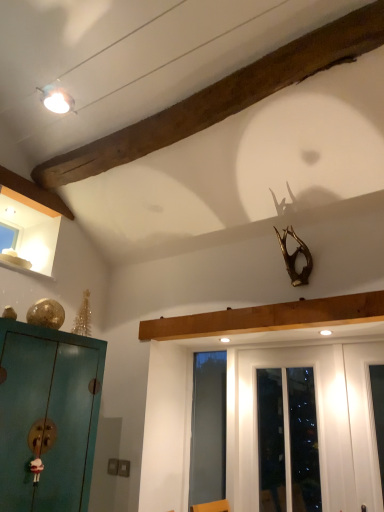
What do you see at coordinates (48, 416) in the screenshot? This screenshot has height=512, width=384. I see `teal matte cabinet at left` at bounding box center [48, 416].

Where is `white glossy door at center`? Image resolution: width=384 pixels, height=512 pixels. white glossy door at center is located at coordinates (317, 421).

You are a GUI agent. You are given a task and a screenshot of the screen. Output one action in this format:
    pyautogui.click(x=<x>, y=<y>)
    Task: Click on the light fixture above the teal matte cabinet at left (from the image's perspective)
    This screenshot has width=384, height=512.
    Given the screenshot: What is the action you would take?
    pyautogui.click(x=56, y=99)

Measure the distance from matte white light fixture at upper left to teal matte cabinet at left.

4.62 feet.

Which of these two, matte white light fixture at upper left or teal matte cabinet at left, is smaller?

Smaller between the two is matte white light fixture at upper left.

Which of these two, matte white light fixture at upper left or teal matte cabinet at left, stands taller?

With more height is teal matte cabinet at left.

Looking at this image, can you confirm if teal matte cabinet at left is wider than wooden beam at upper left?

Incorrect, the width of teal matte cabinet at left does not surpass that of wooden beam at upper left.

Find the location of `molding above the teal matte cabinet at left (from the image's perspective)`. molding above the teal matte cabinet at left (from the image's perspective) is located at coordinates (223, 97).

Does point (74, 460) lie behind point (367, 35)?

Yes, point (74, 460) is farther from viewer.

Can you confirm if teal matte cabinet at left is taller than wooden beam at upper left?

Correct, teal matte cabinet at left is much taller as wooden beam at upper left.

Can you confirm if wooden beam at upper left is shorter than white glossy door at center?

Indeed, wooden beam at upper left has a lesser height compared to white glossy door at center.

Considering the relative sizes of wooden beam at upper left and white glossy door at center in the image provided, is wooden beam at upper left thinner than white glossy door at center?

In fact, wooden beam at upper left might be wider than white glossy door at center.

Is wooden beam at upper left facing towards white glossy door at center?

No, wooden beam at upper left is not oriented towards white glossy door at center.

Is wooden beam at upper left bigger or smaller than white glossy door at center?

In the image, wooden beam at upper left appears to be smaller than white glossy door at center.

Which object is further away from the camera, teal matte cabinet at left or transparent glass screen door at center?

Positioned behind is transparent glass screen door at center.

Between teal matte cabinet at left and transparent glass screen door at center, which one has less height?

With less height is teal matte cabinet at left.

Is teal matte cabinet at left not near transparent glass screen door at center?

Yes, teal matte cabinet at left and transparent glass screen door at center are located far from each other.

Is teal matte cabinet at left aimed at transparent glass screen door at center?

No, teal matte cabinet at left is not aimed at transparent glass screen door at center.

Which object is more forward, wooden beam at upper left or transparent glass screen door at center?

wooden beam at upper left is closer to the camera.

Find the location of a particular element. The width and height of the screenshot is (384, 512). screen door behind the wooden beam at upper left is located at coordinates (208, 428).

Which is correct: wooden beam at upper left is inside transparent glass screen door at center, or outside of it?

wooden beam at upper left is not enclosed by transparent glass screen door at center.

Can you confirm if wooden beam at upper left is positioned to the left of transparent glass screen door at center?

Yes, wooden beam at upper left is to the left of transparent glass screen door at center.

From the image's perspective, does wooden beam at upper left appear lower than matte white light fixture at upper left?

No, from the image's perspective, wooden beam at upper left is not beneath matte white light fixture at upper left.

From a real-world perspective, who is located lower, wooden beam at upper left or matte white light fixture at upper left?

matte white light fixture at upper left.

Who is shorter, wooden beam at upper left or matte white light fixture at upper left?

Standing shorter between the two is wooden beam at upper left.

Does wooden beam at upper left appear on the left side of matte white light fixture at upper left?

No, wooden beam at upper left is not to the left of matte white light fixture at upper left.

Looking at this image, which object is further away from the camera taking this photo, teal matte cabinet at left or matte white light fixture at upper left?

Positioned behind is matte white light fixture at upper left.

Identify the location of cabinetry that appears below the matte white light fixture at upper left (from the image's perspective). (48, 416).

Is matte white light fixture at upper left inside teal matte cabinet at left?

No, matte white light fixture at upper left is not surrounded by teal matte cabinet at left.

How many degrees apart are the facing directions of teal matte cabinet at left and matte white light fixture at upper left?

0.334 degrees separate the facing orientations of teal matte cabinet at left and matte white light fixture at upper left.

The height and width of the screenshot is (512, 384). In order to click on cabinetry in front of the matte white light fixture at upper left in this screenshot , I will do `click(48, 416)`.

Locate an element on the screen. cabinetry below the wooden beam at upper left (from the image's perspective) is located at coordinates (48, 416).

Considering their positions, is teal matte cabinet at left positioned closer to wooden beam at upper left than white glossy door at center?

teal matte cabinet at left is positioned closer to the anchor wooden beam at upper left.

Estimate the real-world distances between objects in this image. Which object is closer to teal matte cabinet at left, white glossy door at center or transparent glass screen door at center?

transparent glass screen door at center.

Estimate the real-world distances between objects in this image. Which object is closer to teal matte cabinet at left, wooden beam at upper left or matte white light fixture at upper left?

Among the two, wooden beam at upper left is located nearer to teal matte cabinet at left.

Based on their spatial positions, is teal matte cabinet at left or wooden beam at upper left further from transparent glass screen door at center?

wooden beam at upper left lies further to transparent glass screen door at center than the other object.

When comparing their distances from matte white light fixture at upper left, does teal matte cabinet at left or white glossy door at center seem further?

Among the two, white glossy door at center is located further to matte white light fixture at upper left.

When comparing their distances from wooden beam at upper left, does transparent glass screen door at center or white glossy door at center seem closer?

white glossy door at center lies closer to wooden beam at upper left than the other object.

Considering their positions, is transparent glass screen door at center positioned further to teal matte cabinet at left than wooden beam at upper left?

wooden beam at upper left is positioned further to the anchor teal matte cabinet at left.

Looking at this image, based on their spatial positions, is matte white light fixture at upper left or white glossy door at center further from teal matte cabinet at left?

Based on the image, matte white light fixture at upper left appears to be further to teal matte cabinet at left.

This screenshot has width=384, height=512. What are the coordinates of `cabinetry between matte white light fixture at upper left and white glossy door at center in the up-down direction` in the screenshot? It's located at (48, 416).

You are a GUI agent. You are given a task and a screenshot of the screen. Output one action in this format:
    pyautogui.click(x=<x>, y=<y>)
    Task: Click on the cabinetry between wooden beam at upper left and white glossy door at center vertically
    
    Given the screenshot: What is the action you would take?
    pyautogui.click(x=48, y=416)

You are a GUI agent. You are given a task and a screenshot of the screen. Output one action in this format:
    pyautogui.click(x=<x>, y=<y>)
    Task: Click on the light fixture that lies between wooden beam at upper left and white glossy door at center from top to bottom
    
    Given the screenshot: What is the action you would take?
    pyautogui.click(x=56, y=99)

This screenshot has width=384, height=512. What are the coordinates of `screen door between teal matte cabinet at left and white glossy door at center` in the screenshot? It's located at (208, 428).